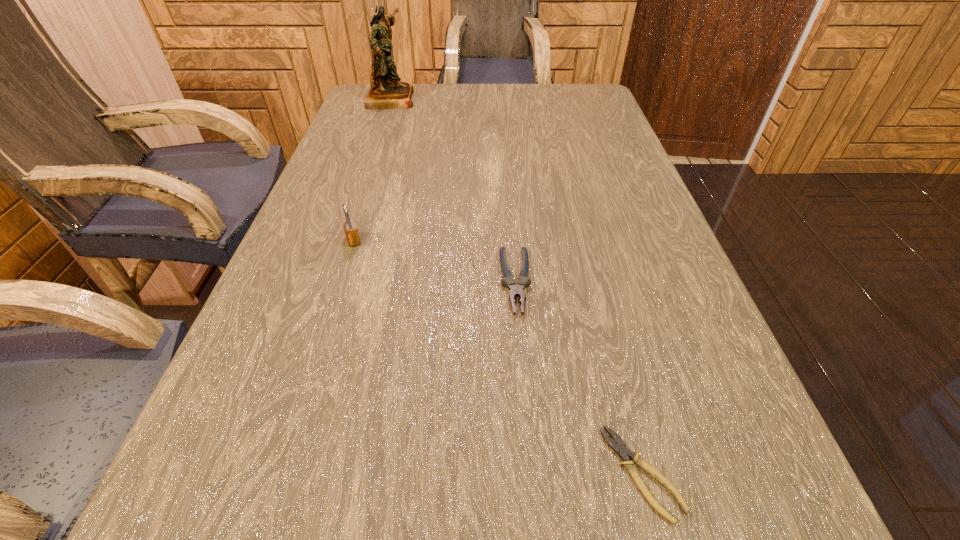
Find the location of a particular element. This screenshot has width=960, height=540. the tallest object is located at coordinates (387, 91).

At what (x,y) coordinates should I click in order to perform the action: click on the farthest object. Please return your answer as a coordinate pair (x, y). The width and height of the screenshot is (960, 540). Looking at the image, I should click on (387, 91).

Identify the location of the third nearest object. The image size is (960, 540). (351, 232).

The height and width of the screenshot is (540, 960). Find the location of `padlock`. padlock is located at coordinates (351, 232).

Where is `the left pliers`? the left pliers is located at coordinates [x=508, y=281].

You are a GUI agent. You are given a task and a screenshot of the screen. Output one action in this format:
    pyautogui.click(x=<x>, y=<y>)
    Task: Click on the second nearest object
    This screenshot has height=540, width=960.
    Given the screenshot: What is the action you would take?
    pyautogui.click(x=508, y=281)

Find the location of a particular element. the shorter pliers is located at coordinates (620, 447).

The width and height of the screenshot is (960, 540). In order to click on the shortest object in this screenshot , I will do `click(620, 447)`.

Where is `vacant space located 0.130m on the front-facing side of the farthest object`? The image size is (960, 540). vacant space located 0.130m on the front-facing side of the farthest object is located at coordinates (458, 98).

Locate an element on the screen. The height and width of the screenshot is (540, 960). free space located on the front of the second tallest object is located at coordinates (295, 427).